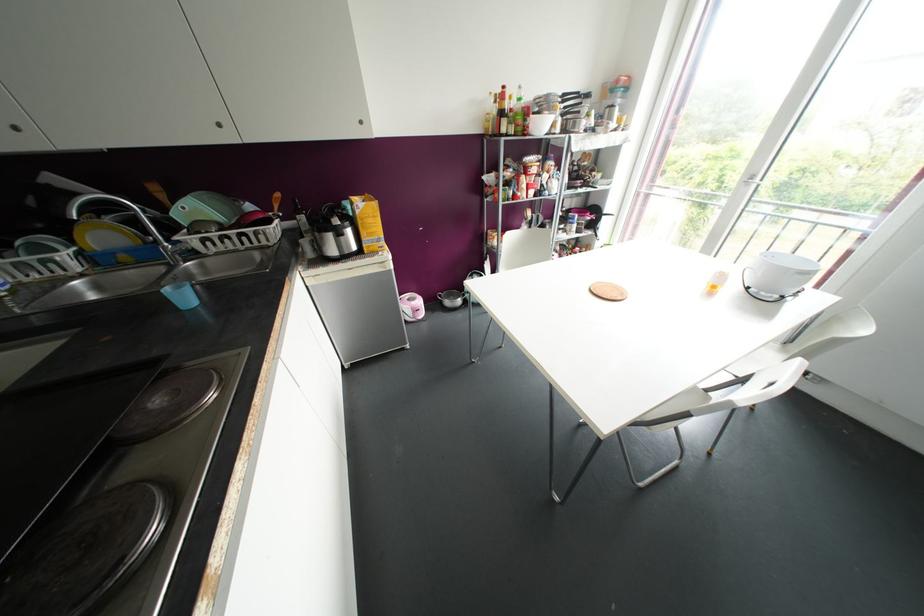
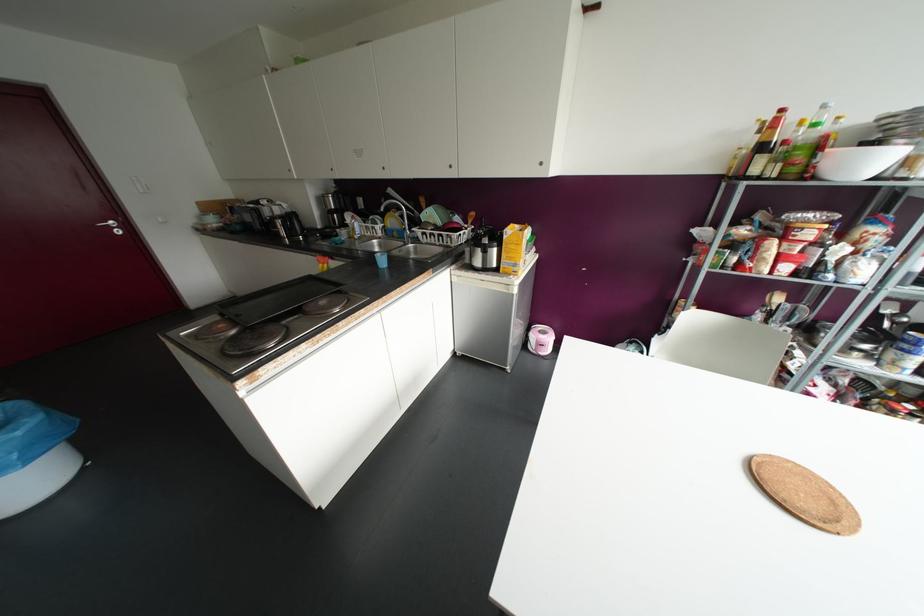
Find the pixel in the second image that matches [188,238] in the first image.

(417, 231)